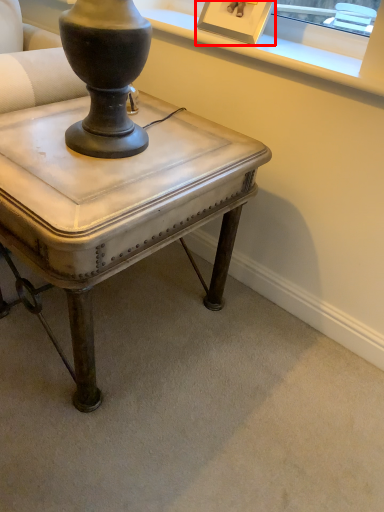
Question: Considering the relative positions of picture frame (annotated by the red box) and table in the image provided, where is picture frame (annotated by the red box) located with respect to the staircase?

Choices:
 (A) right
 (B) left

Answer: (A)